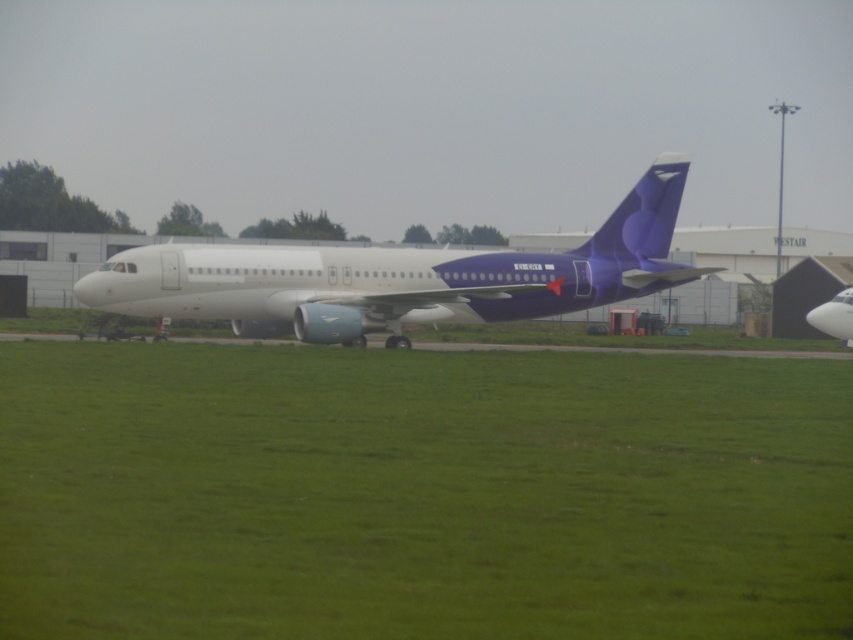
Between green grass at center and white matte airplane at center, which one has less height?

green grass at center is shorter.

Which is more to the right, green grass at center or white matte airplane at center?

white matte airplane at center

Is point (825, 561) positioned in front of point (833, 330)?

Yes, point (825, 561) is closer to viewer.

Identify the location of green grass at center. (421, 493).

Does green grass at center have a greater width compared to white glossy airplane at center?

No.

In the scene shown: Between green grass at center and white glossy airplane at center, which one appears on the left side from the viewer's perspective?

green grass at center is more to the left.

Locate an element on the screen. Image resolution: width=853 pixels, height=640 pixels. green grass at center is located at coordinates (421, 493).

Does white glossy airplane at center lie behind white matte airplane at center?

No, white glossy airplane at center is closer to the viewer.

From the picture: Can you confirm if white glossy airplane at center is smaller than white matte airplane at center?

No.

I want to click on white glossy airplane at center, so click(x=399, y=276).